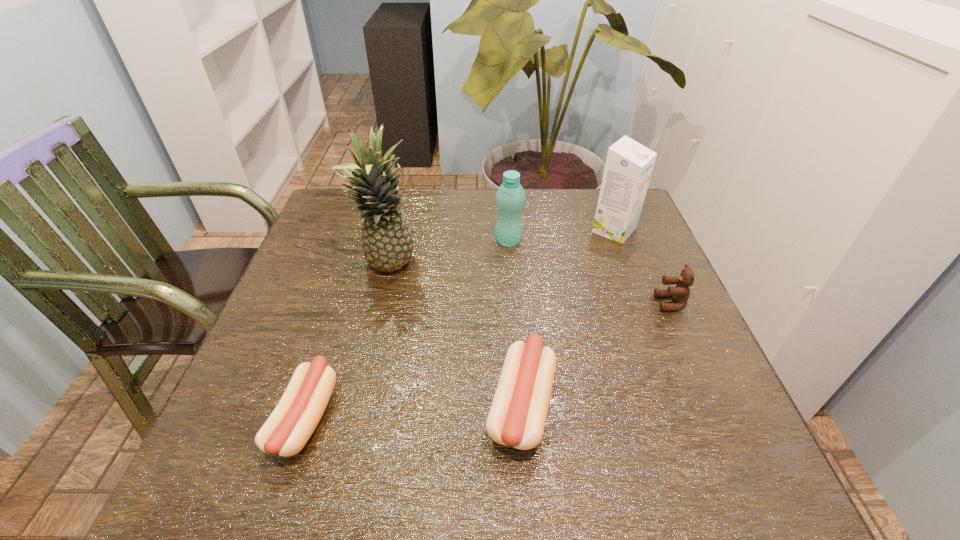
At what (x,y) coordinates should I click in order to perform the action: click on the shorter sausage. Please return your answer as a coordinate pair (x, y). The width and height of the screenshot is (960, 540). Looking at the image, I should click on (297, 414).

The image size is (960, 540). I want to click on the shortest object, so click(297, 414).

Locate an element on the screen. This screenshot has width=960, height=540. the fifth tallest object is located at coordinates (517, 417).

Identify the location of the taller sausage. (517, 417).

The height and width of the screenshot is (540, 960). What are the coordinates of `the fifth shortest object` in the screenshot? It's located at coord(629,165).

The height and width of the screenshot is (540, 960). In order to click on pineapple in this screenshot , I will do `click(387, 244)`.

At what (x,y) coordinates should I click in order to perform the action: click on bottle. Please return your answer as a coordinate pair (x, y). The height and width of the screenshot is (540, 960). Looking at the image, I should click on (510, 197).

Find the location of a particular element. the fourth tallest object is located at coordinates (680, 294).

Identify the location of teddy bear. (680, 294).

The height and width of the screenshot is (540, 960). I want to click on vacant space located 0.220m on the right of the shortest object, so click(x=457, y=417).